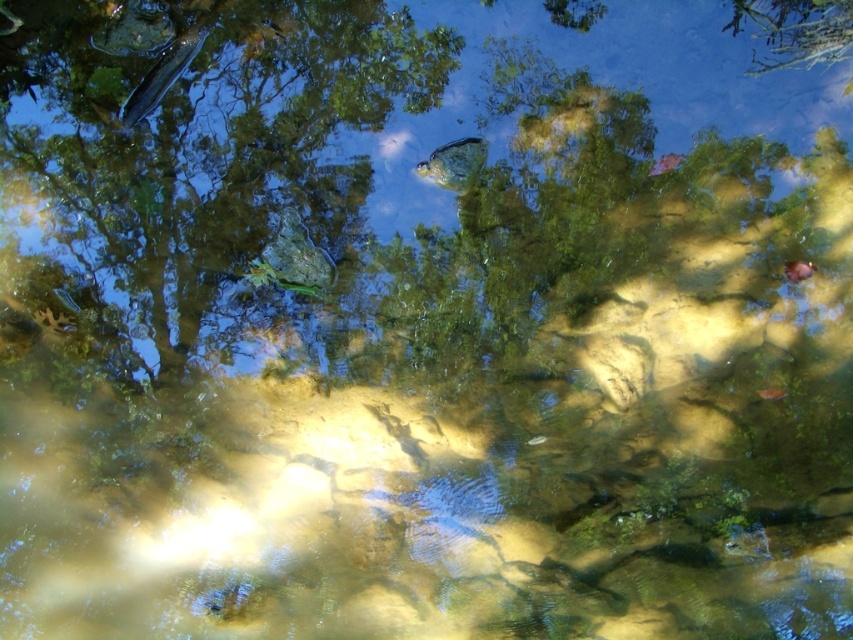
Question: Which is farther from the smooth orange fish at center?

Choices:
 (A) shiny orange fish at lower right
 (B) translucent greenish fish at center
 (C) shiny blue fish at upper left

Answer: (C)

Question: Is smooth orange fish at center below shiny orange fish at lower right?

Choices:
 (A) yes
 (B) no

Answer: (B)

Question: Does shiny blue fish at upper left appear on the left side of translucent greenish fish at center?

Choices:
 (A) yes
 (B) no

Answer: (A)

Question: Among these objects, which one is nearest to the camera?

Choices:
 (A) smooth orange fish at center
 (B) translucent greenish fish at center
 (C) shiny blue fish at upper left
 (D) shiny orange fish at lower right

Answer: (C)

Question: Which point is closer to the camera taking this photo?

Choices:
 (A) (763, 397)
 (B) (788, 276)

Answer: (B)

Question: Is shiny blue fish at upper left above translucent greenish fish at center?

Choices:
 (A) yes
 (B) no

Answer: (A)